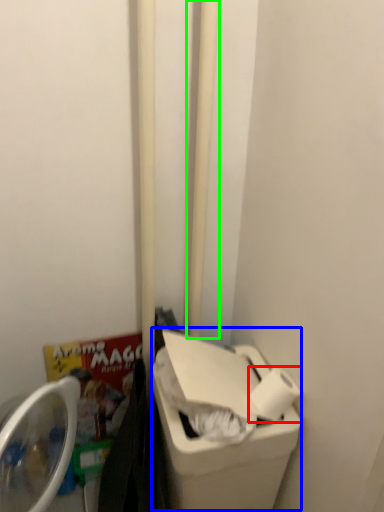
Question: Estimate the real-world distances between objects in this image. Which object is farther from toilet paper (highlighted by a red box), recycling bin (highlighted by a blue box) or pole (highlighted by a green box)?

Choices:
 (A) recycling bin
 (B) pole

Answer: (B)